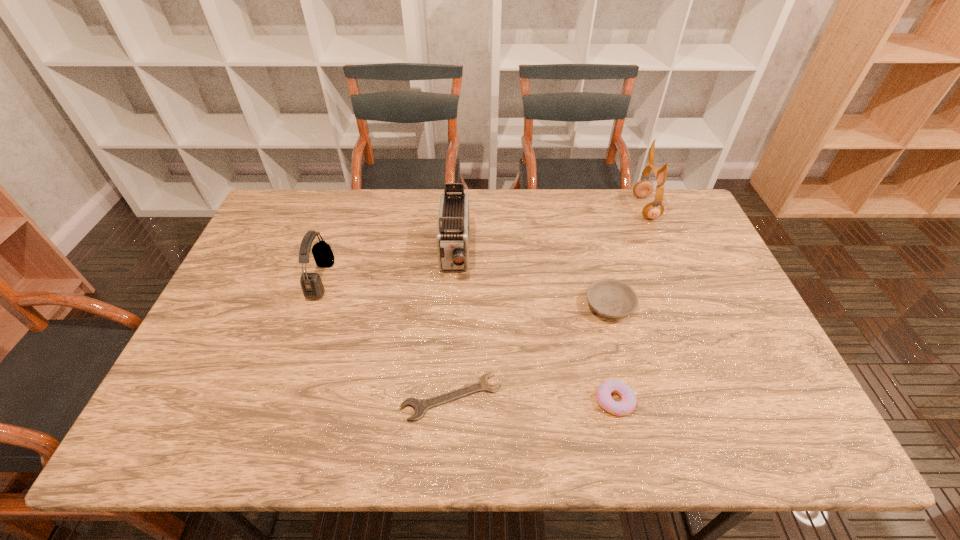
Identify the location of vacant space in between the second shortest object and the camcorder. (535, 327).

The height and width of the screenshot is (540, 960). In order to click on vacant area that lies between the leftmost object and the camcorder in this screenshot , I will do `click(388, 266)`.

You are a GUI agent. You are given a task and a screenshot of the screen. Output one action in this format:
    pyautogui.click(x=<x>, y=<y>)
    Task: Click on the free area in between the fourth tallest object and the earphone
    The width and height of the screenshot is (960, 540).
    Given the screenshot: What is the action you would take?
    pyautogui.click(x=627, y=257)

I want to click on empty space between the fourth shortest object and the earphone, so click(483, 244).

This screenshot has height=540, width=960. Find the location of `free space between the bowl and the farthest object`. free space between the bowl and the farthest object is located at coordinates (627, 257).

Locate an element on the screen. The image size is (960, 540). empty location between the camcorder and the farthest object is located at coordinates (550, 231).

Find the location of a particular element. This screenshot has width=960, height=540. empty location between the third tallest object and the shortest object is located at coordinates pos(386,338).

Locate an element on the screen. The image size is (960, 540). free space between the farthest object and the bowl is located at coordinates (627, 257).

The height and width of the screenshot is (540, 960). I want to click on the fifth closest object relative to the camcorder, so click(644, 188).

At what (x,y) coordinates should I click in order to perform the action: click on object that is the fifth closest to the doughnut. Please return your answer as a coordinate pair (x, y). Looking at the image, I should click on (311, 283).